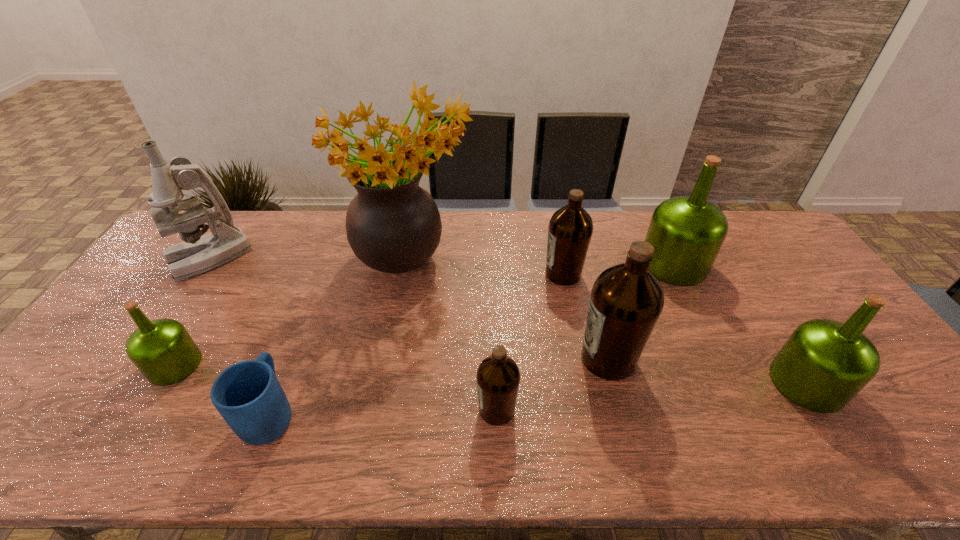
Where is `flower arrangement that is positioned at the far edge`? The width and height of the screenshot is (960, 540). flower arrangement that is positioned at the far edge is located at coordinates (393, 225).

Identify the location of microscope present at the far edge. Image resolution: width=960 pixels, height=540 pixels. pos(197,254).

Locate an element on the screen. Image resolution: width=960 pixels, height=540 pixels. olive oil present at the far edge is located at coordinates (687, 232).

The height and width of the screenshot is (540, 960). I want to click on olive oil that is at the near edge, so click(498, 377).

This screenshot has height=540, width=960. In order to click on mug that is at the near edge in this screenshot , I will do `click(248, 395)`.

The width and height of the screenshot is (960, 540). In order to click on object that is at the left edge in this screenshot , I will do `click(197, 254)`.

Locate an element on the screen. The width and height of the screenshot is (960, 540). object at the right edge is located at coordinates (824, 364).

The height and width of the screenshot is (540, 960). Identify the location of object that is at the far left corner. (197, 254).

I want to click on free space at the far edge of the desktop, so click(x=304, y=213).

In the image, there is a desktop. In order to click on vacant space at the near edge in this screenshot , I will do `click(738, 437)`.